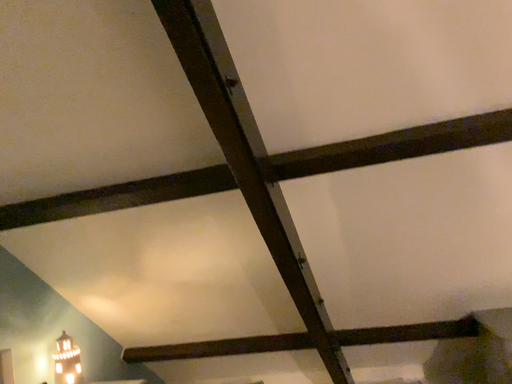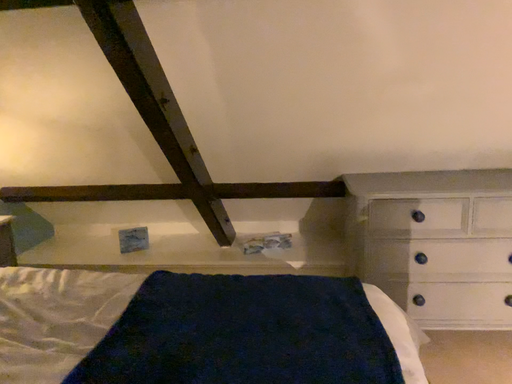
Question: Which way did the camera rotate in the video?

Choices:
 (A) rotated left
 (B) rotated right

Answer: (B)